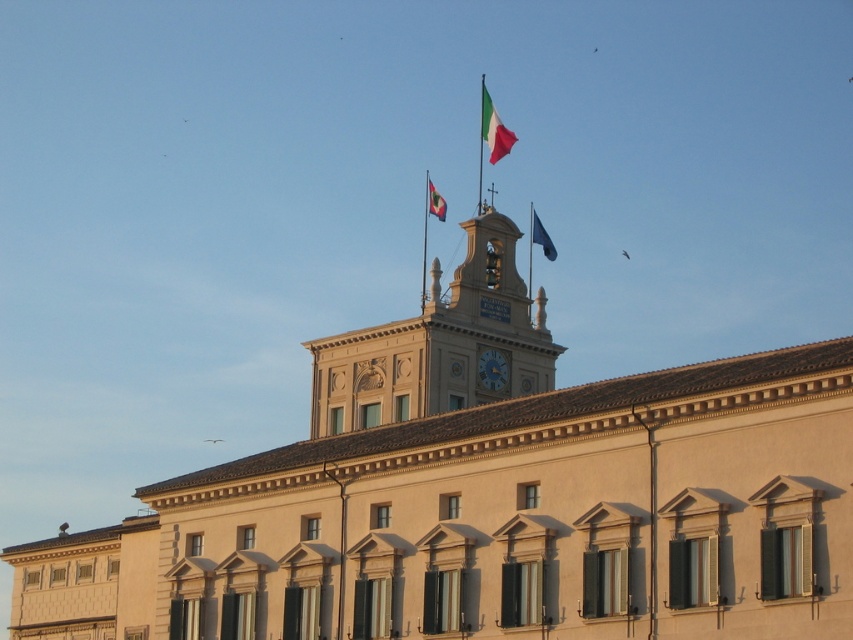
Can you confirm if red fabric flag at upper center is positioned above blue fabric flag at upper center?

Indeed, red fabric flag at upper center is positioned over blue fabric flag at upper center.

Can you confirm if red fabric flag at upper center is smaller than blue fabric flag at upper center?

Yes.

Between point (486, 97) and point (543, 227), which one is positioned in front?

Point (486, 97) is more forward.

What are the coordinates of `red fabric flag at upper center` in the screenshot? It's located at (492, 129).

Is blue fabric flag at upper center in front of matte red flag at upper center?

Yes.

Does blue fabric flag at upper center lie behind matte red flag at upper center?

No, blue fabric flag at upper center is in front of matte red flag at upper center.

Does point (538, 243) lie in front of point (439, 212)?

Yes, it is.

Find the location of a particular element. This screenshot has width=853, height=640. blue fabric flag at upper center is located at coordinates (541, 236).

Does matte gold clock at center have a lesser width compared to matte red flag at upper center?

Yes.

Is matte gold clock at center wider than matte red flag at upper center?

No.

Between point (480, 355) and point (433, 186), which one is positioned in front?

Point (480, 355) is more forward.

Locate an element on the screen. The image size is (853, 640). matte gold clock at center is located at coordinates (492, 369).